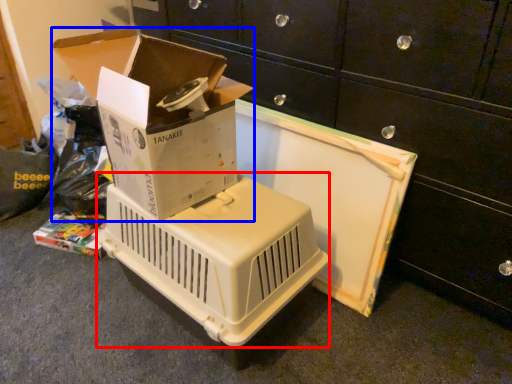
Question: Which of the following is the farthest to the observer, appliance (highlighted by a red box) or box (highlighted by a blue box)?

Choices:
 (A) appliance
 (B) box

Answer: (A)